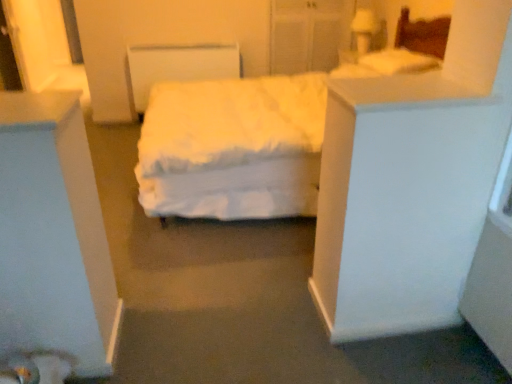
Question: Is white soft pillow at upper right closer to camera compared to white soft bed at center?

Choices:
 (A) yes
 (B) no

Answer: (B)

Question: Does white soft pillow at upper right turn towards white soft bed at center?

Choices:
 (A) yes
 (B) no

Answer: (A)

Question: Considering the relative sizes of white soft pillow at upper right and white soft bed at center in the image provided, is white soft pillow at upper right shorter than white soft bed at center?

Choices:
 (A) yes
 (B) no

Answer: (A)

Question: Is white soft pillow at upper right completely or partially outside of white soft bed at center?

Choices:
 (A) no
 (B) yes

Answer: (A)

Question: Is white soft pillow at upper right to the left of white soft bed at center from the viewer's perspective?

Choices:
 (A) no
 (B) yes

Answer: (A)

Question: From a real-world perspective, is white soft pillow at upper right on white soft bed at center?

Choices:
 (A) no
 (B) yes

Answer: (B)

Question: Does white soft bed at center have a greater width compared to white soft pillow at upper right?

Choices:
 (A) yes
 (B) no

Answer: (A)

Question: Is white soft bed at center outside white soft pillow at upper right?

Choices:
 (A) no
 (B) yes

Answer: (B)

Question: Does white soft bed at center turn towards white soft pillow at upper right?

Choices:
 (A) yes
 (B) no

Answer: (B)

Question: Is white soft bed at center thinner than white soft pillow at upper right?

Choices:
 (A) no
 (B) yes

Answer: (A)

Question: From the image's perspective, is white soft bed at center located beneath white soft pillow at upper right?

Choices:
 (A) no
 (B) yes

Answer: (B)

Question: Is white soft bed at center bigger than white soft pillow at upper right?

Choices:
 (A) yes
 (B) no

Answer: (A)

Question: From a real-world perspective, is white soft pillow at upper right above or below white soft bed at center?

Choices:
 (A) below
 (B) above

Answer: (B)